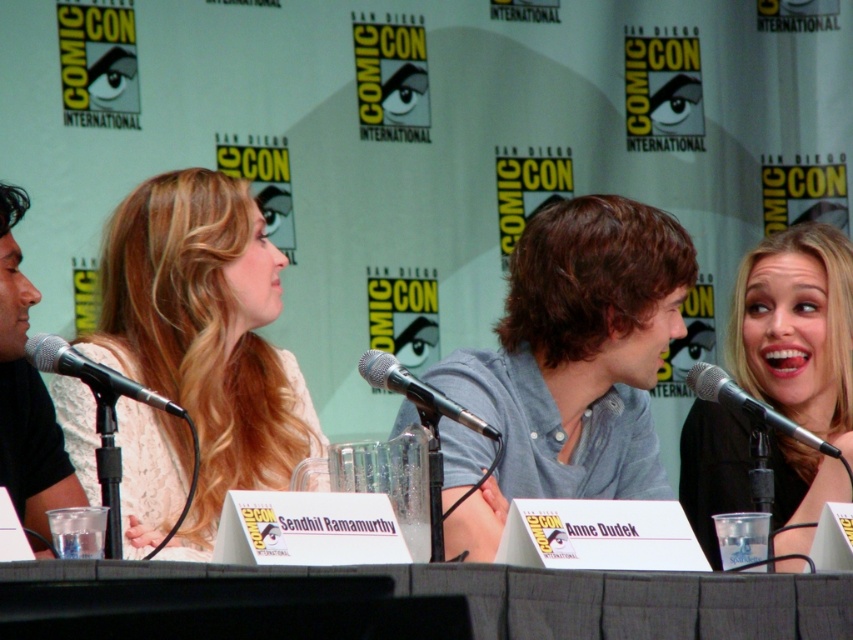
You are organizing a photo shoot for a fashion magazine and need to ensure the white lace dress at left and the black metallic microphone at center are both visible in the frame. Given their sizes, which object should you focus on to ensure both are in the shot without cropping?

The white lace dress at left is larger in size compared to the black metallic microphone at center, so you should focus on positioning the dress first to ensure it fits within the frame, allowing space for the microphone as well.

What is located at the coordinate point (206, 332) in the image?

The white lace dress at left is located at the coordinate point (206, 332).